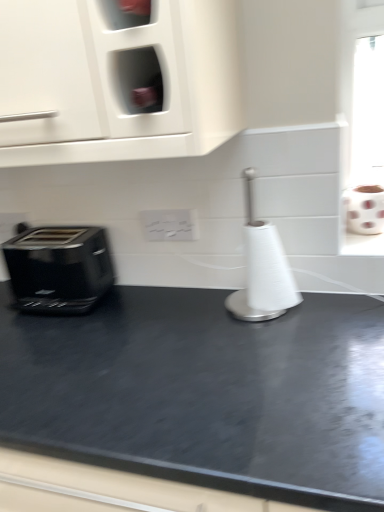
Question: Considering their positions, is white paper towel holder at center located in front of or behind black glossy toaster at left?

Choices:
 (A) behind
 (B) front

Answer: (B)

Question: In the image, is white paper towel holder at center on the left side or the right side of black glossy toaster at left?

Choices:
 (A) right
 (B) left

Answer: (A)

Question: Based on their relative distances, which object is farther from the white paper towel holder at center?

Choices:
 (A) white glossy electric outlet at center
 (B) white matte toilet paper at right
 (C) black glossy toaster at left

Answer: (C)

Question: Estimate the real-world distances between objects in this image. Which object is closer to the white glossy electric outlet at center?

Choices:
 (A) black glossy toaster at left
 (B) white paper towel holder at center
 (C) white matte toilet paper at right

Answer: (B)